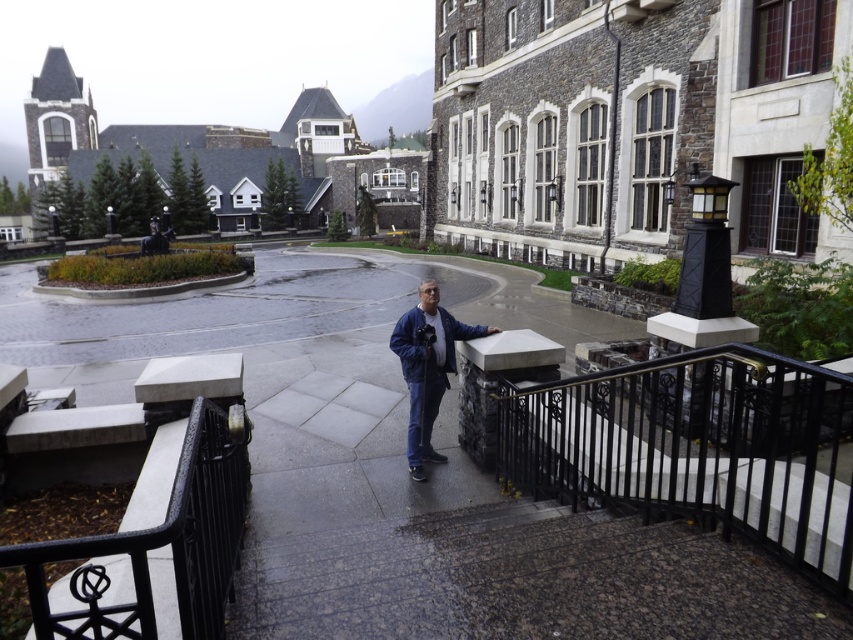
Between point (640, 476) and point (151, 536), which one is positioned in front?

Point (151, 536) is more forward.

Between black wrought iron railing at center and black wrought iron at center, which one has less height?

Standing shorter between the two is black wrought iron at center.

Who is more forward, (704, 372) or (183, 464)?

Point (183, 464) is more forward.

This screenshot has width=853, height=640. In order to click on black wrought iron railing at center in this screenshot , I will do `click(698, 449)`.

Can you confirm if black wrought iron at center is positioned to the right of blue denim jacket at center?

In fact, black wrought iron at center is to the left of blue denim jacket at center.

Does black wrought iron at center come behind blue denim jacket at center?

No.

You are a GUI agent. You are given a task and a screenshot of the screen. Output one action in this format:
    pyautogui.click(x=<x>, y=<y>)
    Task: Click on the black wrought iron at center
    
    Given the screenshot: What is the action you would take?
    pyautogui.click(x=160, y=541)

Does blue denim jacket at center have a larger size compared to blue matte jacket at center?

Yes, blue denim jacket at center is bigger than blue matte jacket at center.

You are a GUI agent. You are given a task and a screenshot of the screen. Output one action in this format:
    pyautogui.click(x=<x>, y=<y>)
    Task: Click on the blue denim jacket at center
    
    Given the screenshot: What is the action you would take?
    pyautogui.click(x=427, y=368)

Locate an element on the screen. Image resolution: width=853 pixels, height=640 pixels. blue denim jacket at center is located at coordinates (427, 368).